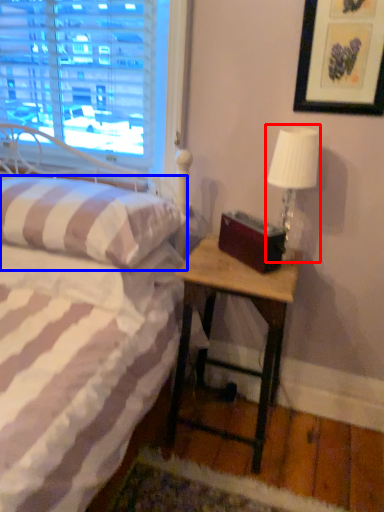
Question: Which object appears farthest to the camera in this image, table lamp (highlighted by a red box) or pillow (highlighted by a blue box)?

Choices:
 (A) table lamp
 (B) pillow

Answer: (A)